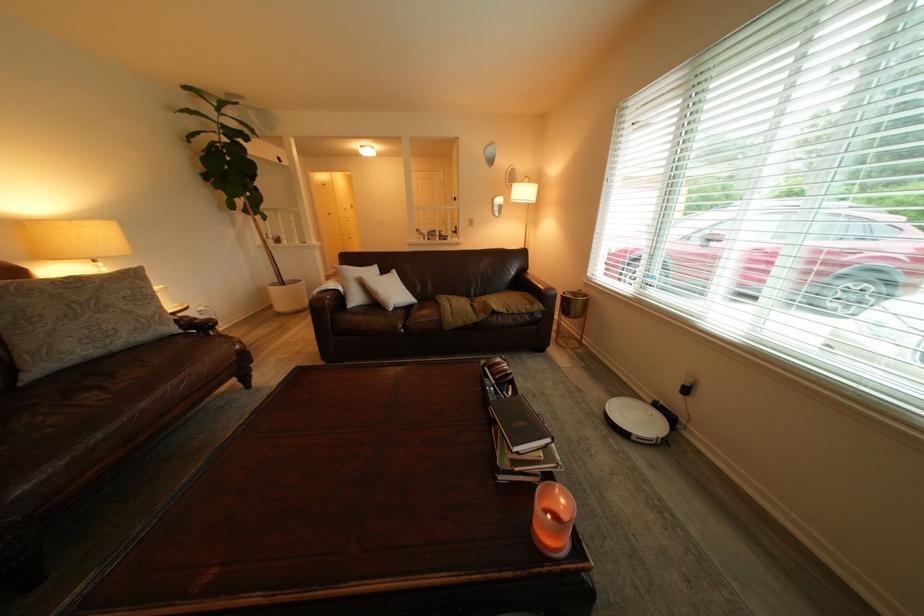
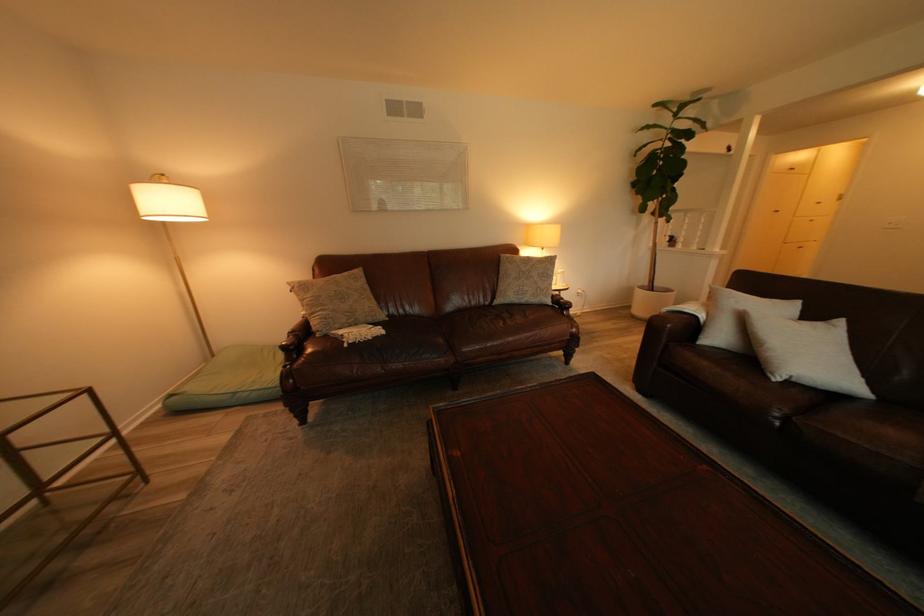
Find the pixel in the second image that matches pixel 246 207 in the first image.

(657, 209)